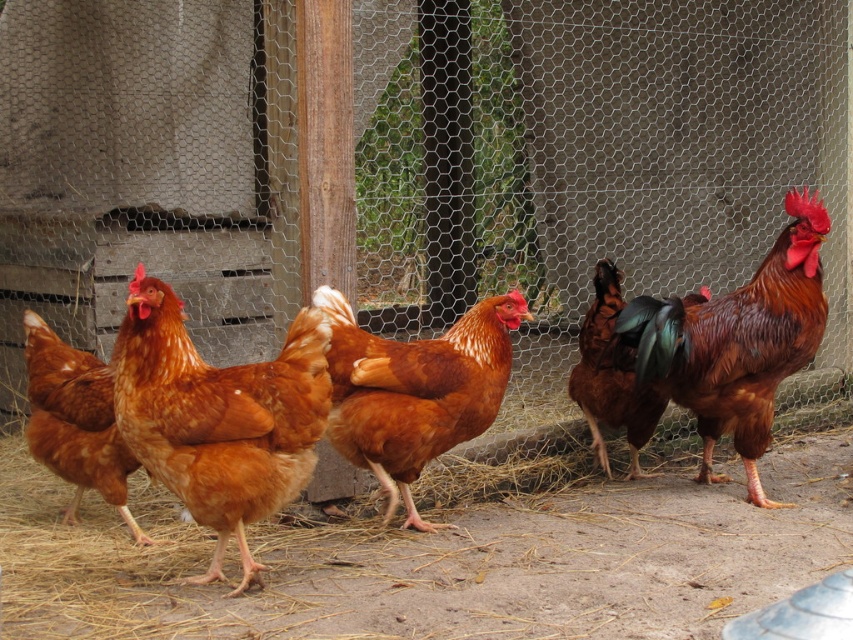
Looking at this image, you are standing at the origin point of the image. The brown feathered chicken at left is located at coordinates 0.658 on the x axis and 0.089 on the y axis. If you want to walk directly to the chicken, in which direction should you move? Please provide your answer in terms of compass directions like north, south, east, or west.

To reach the brown feathered chicken at left, you should move northeast since the chicken is located at a higher x coordinate and lower y coordinate compared to the origin point.